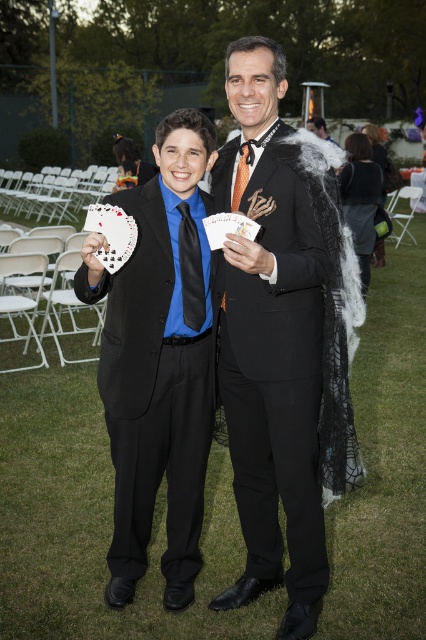
You are a photographer at the event and need to capture a clear photo of the black satin suit at center without the white matte hand at center blocking it. How should you adjust your camera angle?

The black satin suit at center is positioned under the white matte hand at center. To avoid the hand blocking the suit, you should angle the camera upward to focus on the suit while keeping the hand out of the frame.

In the scene shown: You are standing at the origin point of the coordinate system in the image. Which direction should you move to reach the matte black suit at center?

Since the matte black suit at center is located at coordinate point 0.564 in the x direction and 0.373 in the y direction, you should move northeast to reach it.